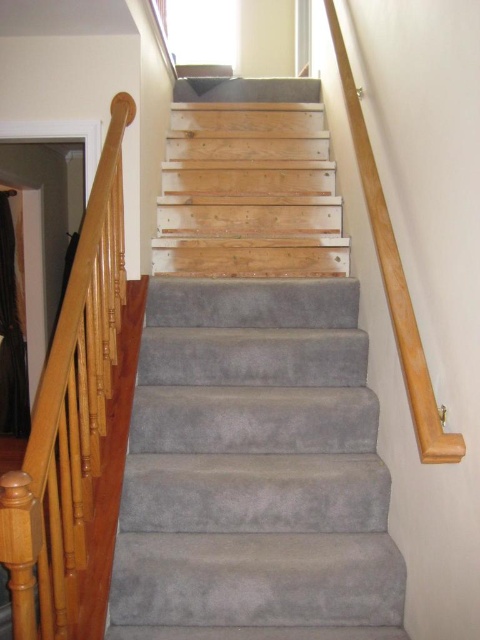
Image resolution: width=480 pixels, height=640 pixels. What do you see at coordinates (254, 470) in the screenshot?
I see `gray carpeted stairs at center` at bounding box center [254, 470].

Is point (182, 355) less distant than point (111, 452)?

No, it is behind (111, 452).

Between point (181, 432) and point (32, 436), which one is positioned behind?

Positioned behind is point (181, 432).

Where is `gray carpeted stairs at center`? The width and height of the screenshot is (480, 640). gray carpeted stairs at center is located at coordinates (254, 470).